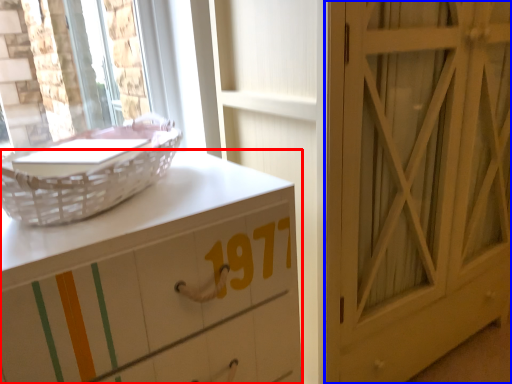
Question: Which point is further to the camera, chest of drawers (highlighted by a red box) or door (highlighted by a blue box)?

Choices:
 (A) chest of drawers
 (B) door

Answer: (B)